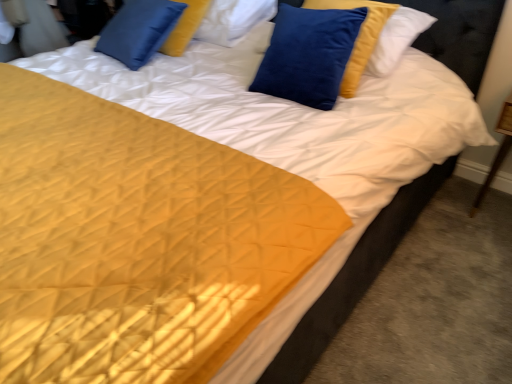
The height and width of the screenshot is (384, 512). I want to click on velvet blue pillow at center, so click(x=308, y=54).

Image resolution: width=512 pixels, height=384 pixels. Describe the element at coordinates (308, 54) in the screenshot. I see `velvet blue pillow at center` at that location.

Find the location of a particular element. velvet blue pillow at center is located at coordinates (308, 54).